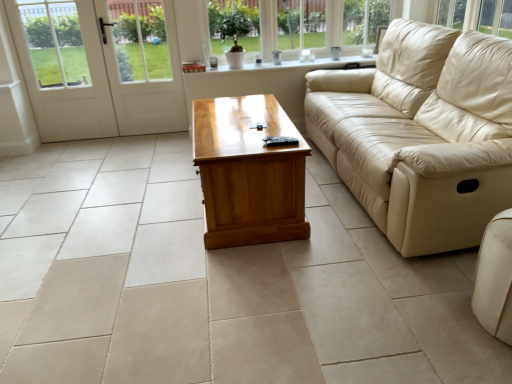
You are a GUI agent. You are given a task and a screenshot of the screen. Output one action in this format:
    pyautogui.click(x=<x>, y=<y>)
    Task: Click on the vacant space positioned to the left of beige leather couch at right, marked as the first studio couch in a back-to-front arrangement
    
    Given the screenshot: What is the action you would take?
    pyautogui.click(x=163, y=217)